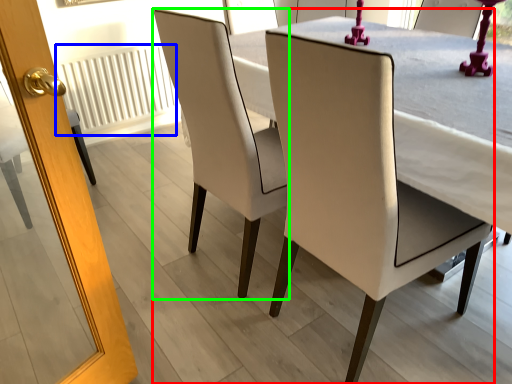
Question: Considering the real-world distances, which object is farthest from chair (highlighted by a red box)? radiator (highlighted by a blue box) or chair (highlighted by a green box)?

Choices:
 (A) radiator
 (B) chair

Answer: (A)